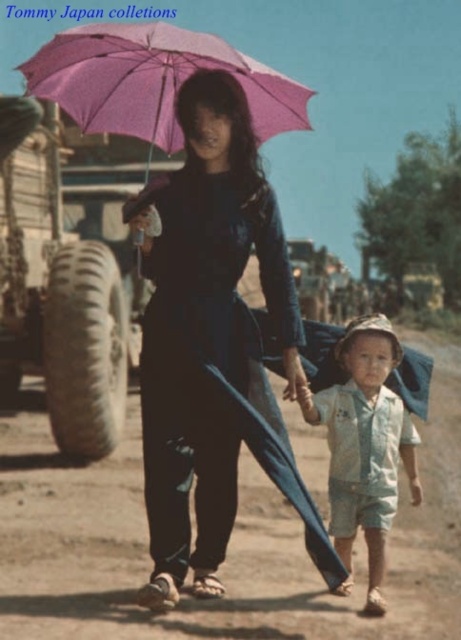
Does rubber tire at left have a larger size compared to light blue cotton shirt at lower right?

Indeed, rubber tire at left has a larger size compared to light blue cotton shirt at lower right.

Does point (49, 397) come farther from viewer compared to point (360, 436)?

Yes, point (49, 397) is behind point (360, 436).

You are a GUI agent. You are given a task and a screenshot of the screen. Output one action in this format:
    pyautogui.click(x=<x>, y=<y>)
    Task: Click on the rubber tire at left
    
    Given the screenshot: What is the action you would take?
    pyautogui.click(x=60, y=296)

Where is `matte black ao dai at center`? matte black ao dai at center is located at coordinates (216, 346).

Does matte black ao dai at center have a lesser width compared to light blue cotton shirt at lower right?

Incorrect, matte black ao dai at center's width is not less than light blue cotton shirt at lower right's.

Does point (252, 342) come closer to viewer compared to point (370, 330)?

No, (252, 342) is behind (370, 330).

Find the location of a particular element. The height and width of the screenshot is (640, 461). matte black ao dai at center is located at coordinates (216, 346).

Does matte black ao dai at center appear on the right side of rubber tire at left?

Correct, you'll find matte black ao dai at center to the right of rubber tire at left.

Between matte black ao dai at center and rubber tire at left, which one has more height?

matte black ao dai at center

Which is in front, point (143, 260) or point (11, 252)?

Point (143, 260) is more forward.

You are a GUI agent. You are given a task and a screenshot of the screen. Output one action in this format:
    pyautogui.click(x=<x>, y=<y>)
    Task: Click on the matte black ao dai at center
    
    Given the screenshot: What is the action you would take?
    pyautogui.click(x=216, y=346)